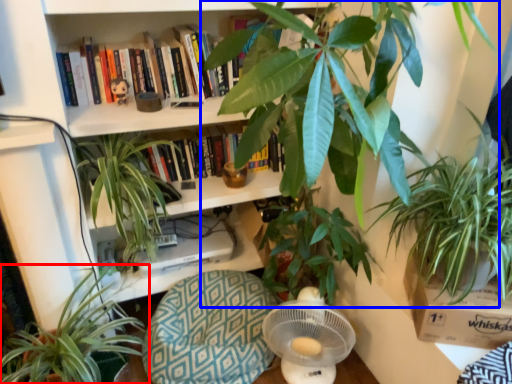
Question: Which of the following is the closest to the observer, houseplant (highlighted by a red box) or houseplant (highlighted by a blue box)?

Choices:
 (A) houseplant
 (B) houseplant

Answer: (B)